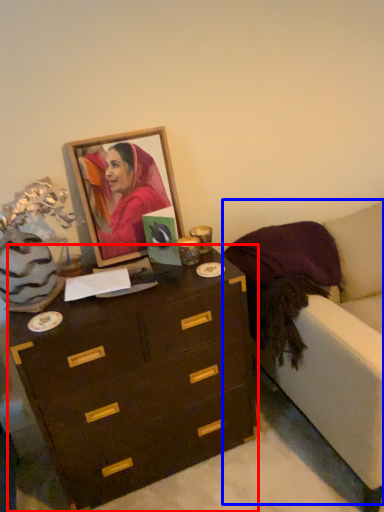
Question: Which object appears farthest to the camera in this image, chest of drawers (highlighted by a red box) or armchair (highlighted by a blue box)?

Choices:
 (A) chest of drawers
 (B) armchair

Answer: (A)